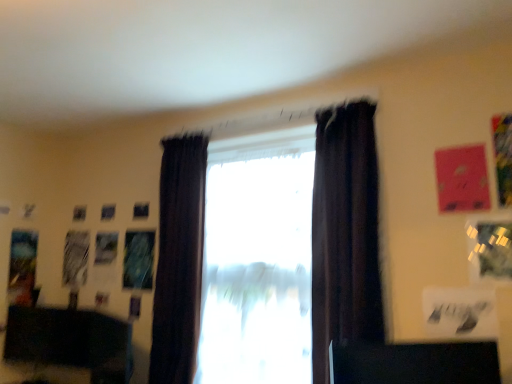
The height and width of the screenshot is (384, 512). Describe the element at coordinates (345, 233) in the screenshot. I see `dark velvet curtain at center, the second curtain from the back` at that location.

How much space does transparent glass window at center, which ranks as the 2th window in left-to-right order, occupy horizontally?

It is 15.23 centimeters.

In order to face black glossy desk at lower right, the 2th furniture ordered from the bottom, should I rotate leftwards or rightwards?

Rotate your view right by about 20.052°.

In order to face dark fabric curtain at center, acting as the first curtain starting from the back, should I rotate leftwards or rightwards?

You should look left and rotate roughly 10.536 degrees.

Measure the distance between dark fabric curtain at center, acting as the first curtain starting from the back, and camera.

7.79 feet.

Where is `satin dark curtains at center, the 2th window from the right`? The image size is (512, 384). satin dark curtains at center, the 2th window from the right is located at coordinates (344, 232).

This screenshot has height=384, width=512. What are the coordinates of `dark velvet curtain at center, the first curtain positioned from the front` in the screenshot? It's located at (345, 233).

Looking at this image, is satin dark curtains at center, marked as the 1th window in a left-to-right arrangement, further to camera compared to black glossy desk at lower right, arranged as the 2th furniture when viewed from the back?

Yes.

From the image's perspective, is satin dark curtains at center, marked as the 1th window in a left-to-right arrangement, on top of black glossy desk at lower right, which ranks as the 1th furniture in front-to-back order?

Yes, from the image's perspective, satin dark curtains at center, marked as the 1th window in a left-to-right arrangement, is above black glossy desk at lower right, which ranks as the 1th furniture in front-to-back order.

Would you say satin dark curtains at center, marked as the 1th window in a left-to-right arrangement, is a long distance from black glossy desk at lower right, which appears as the 2th furniture when viewed from the left?

Absolutely, satin dark curtains at center, marked as the 1th window in a left-to-right arrangement, is distant from black glossy desk at lower right, which appears as the 2th furniture when viewed from the left.

Is satin dark curtains at center, marked as the 1th window in a left-to-right arrangement, facing away from black glossy desk at lower right, arranged as the 2th furniture when viewed from the back?

satin dark curtains at center, marked as the 1th window in a left-to-right arrangement, is not turned away from black glossy desk at lower right, arranged as the 2th furniture when viewed from the back.

From the image's perspective, which is below, black glossy desk at lower right, which ranks as the 1th furniture in front-to-back order, or transparent glass window at center, which ranks as the 2th window in left-to-right order?

black glossy desk at lower right, which ranks as the 1th furniture in front-to-back order.

Relative to transparent glass window at center, which ranks as the 2th window in left-to-right order, is black glossy desk at lower right, acting as the first furniture starting from the top, in front or behind?

Visually, black glossy desk at lower right, acting as the first furniture starting from the top, is located in front of transparent glass window at center, which ranks as the 2th window in left-to-right order.

Who is bigger, black glossy desk at lower right, which appears as the 2th furniture when viewed from the left, or transparent glass window at center, acting as the first window starting from the right?

With larger size is transparent glass window at center, acting as the first window starting from the right.

Considering the sizes of black glossy desk at lower right, arranged as the 2th furniture when viewed from the back, and transparent glass window at center, acting as the first window starting from the right, in the image, is black glossy desk at lower right, arranged as the 2th furniture when viewed from the back, taller or shorter than transparent glass window at center, acting as the first window starting from the right,?

black glossy desk at lower right, arranged as the 2th furniture when viewed from the back, is shorter than transparent glass window at center, acting as the first window starting from the right.

In the image, is transparent glass window at center, which ranks as the 2th window in left-to-right order, positioned in front of or behind black matte desk at lower left, the second furniture when ordered from right to left?

In the image, transparent glass window at center, which ranks as the 2th window in left-to-right order, appears in front of black matte desk at lower left, the second furniture when ordered from right to left.

From a real-world perspective, which object rests below the other?

From a 3D spatial view, black matte desk at lower left, which is counted as the 1th furniture, starting from the left, is below.

Which is in front, point (222, 326) or point (112, 335)?

Positioned in front is point (222, 326).

In terms of height, does transparent glass window at center, which ranks as the 2th window in left-to-right order, look taller or shorter compared to black matte desk at lower left, the second furniture when ordered from right to left?

Considering their sizes, transparent glass window at center, which ranks as the 2th window in left-to-right order, has more height than black matte desk at lower left, the second furniture when ordered from right to left.

Looking at this image, could you tell me if dark velvet curtain at center, which is counted as the second curtain, starting from the left, is turned towards black matte desk at lower left, the second furniture when ordered from right to left?

No.

In the image, is dark velvet curtain at center, arranged as the 1th curtain when viewed from the right, on the left side or the right side of black matte desk at lower left, which ranks as the 2th furniture in front-to-back order?

Based on their positions, dark velvet curtain at center, arranged as the 1th curtain when viewed from the right, is located to the right of black matte desk at lower left, which ranks as the 2th furniture in front-to-back order.

Can you confirm if dark velvet curtain at center, arranged as the 1th curtain when viewed from the right, is wider than black matte desk at lower left, the second furniture when ordered from right to left?

Indeed, dark velvet curtain at center, arranged as the 1th curtain when viewed from the right, has a greater width compared to black matte desk at lower left, the second furniture when ordered from right to left.

From a real-world perspective, between dark velvet curtain at center, arranged as the 1th curtain when viewed from the right, and black matte desk at lower left, the second furniture when ordered from right to left, who is vertically higher?

dark velvet curtain at center, arranged as the 1th curtain when viewed from the right, from a real-world perspective.

Which object is more forward, satin dark curtains at center, marked as the 1th window in a left-to-right arrangement, or dark fabric curtain at center, acting as the first curtain starting from the back?

satin dark curtains at center, marked as the 1th window in a left-to-right arrangement, is in front.

Is satin dark curtains at center, marked as the 1th window in a left-to-right arrangement, not near dark fabric curtain at center, the 2th curtain from the right?

No, satin dark curtains at center, marked as the 1th window in a left-to-right arrangement, is not far away from dark fabric curtain at center, the 2th curtain from the right.

Between satin dark curtains at center, marked as the 1th window in a left-to-right arrangement, and dark fabric curtain at center, marked as the 2th curtain in a front-to-back arrangement, which one appears on the right side from the viewer's perspective?

Positioned to the right is satin dark curtains at center, marked as the 1th window in a left-to-right arrangement.

Who is bigger, satin dark curtains at center, the 2th window from the right, or dark fabric curtain at center, marked as the 2th curtain in a front-to-back arrangement?

With larger size is dark fabric curtain at center, marked as the 2th curtain in a front-to-back arrangement.

Is black matte desk at lower left, which ranks as the 2th furniture in front-to-back order, touching black glossy desk at lower right, which appears as the 2th furniture when viewed from the left?

No.

The image size is (512, 384). I want to click on furniture lying on the right of black matte desk at lower left, which ranks as the 2th furniture in front-to-back order, so click(x=414, y=363).

Is black matte desk at lower left, which ranks as the 2th furniture in front-to-back order, wider or thinner than black glossy desk at lower right, the 2th furniture ordered from the bottom?

In the image, black matte desk at lower left, which ranks as the 2th furniture in front-to-back order, appears to be more narrow than black glossy desk at lower right, the 2th furniture ordered from the bottom.

Which is in front, black matte desk at lower left, arranged as the second furniture when viewed from the top, or black glossy desk at lower right, which appears as the 2th furniture when viewed from the left?

black glossy desk at lower right, which appears as the 2th furniture when viewed from the left.

Which of these two, satin dark curtains at center, marked as the 1th window in a left-to-right arrangement, or transparent glass window at center, which ranks as the 2th window in left-to-right order, stands shorter?

transparent glass window at center, which ranks as the 2th window in left-to-right order.

From a real-world perspective, is satin dark curtains at center, the 2th window from the right, located beneath transparent glass window at center, acting as the first window starting from the right?

No.

At what (x,y) coordinates should I click in order to perform the action: click on window behind the satin dark curtains at center, marked as the 1th window in a left-to-right arrangement. Please return your answer as a coordinate pair (x, y). The height and width of the screenshot is (384, 512). Looking at the image, I should click on (258, 269).

How different are the orientations of satin dark curtains at center, marked as the 1th window in a left-to-right arrangement, and transparent glass window at center, acting as the first window starting from the right, in degrees?

0.00128 degrees.

Which window is the 1st one when counting from the back of the black glossy desk at lower right, the 2th furniture ordered from the bottom? Please provide its 2D coordinates.

[(344, 232)]

From the image's perspective, count 1st furnitures downward from the transparent glass window at center, which ranks as the 2th window in left-to-right order, and point to it. Please provide its 2D coordinates.

[(414, 363)]

Estimate the real-world distances between objects in this image. Which object is further from black matte desk at lower left, acting as the first furniture starting from the back, transparent glass window at center, which ranks as the 2th window in left-to-right order, or satin dark curtains at center, the 2th window from the right?

The object further to black matte desk at lower left, acting as the first furniture starting from the back, is transparent glass window at center, which ranks as the 2th window in left-to-right order.

From the image, which object appears to be nearer to dark fabric curtain at center, acting as the first curtain starting from the back, black matte desk at lower left, which ranks as the 2th furniture in front-to-back order, or transparent glass window at center, acting as the first window starting from the right?

Based on the image, transparent glass window at center, acting as the first window starting from the right, appears to be nearer to dark fabric curtain at center, acting as the first curtain starting from the back.

Considering their positions, is transparent glass window at center, which ranks as the 2th window in left-to-right order, positioned further to black glossy desk at lower right, arranged as the 2th furniture when viewed from the back, than satin dark curtains at center, the 2th window from the right?

satin dark curtains at center, the 2th window from the right.

Based on their spatial positions, is black glossy desk at lower right, arranged as the 2th furniture when viewed from the back, or dark velvet curtain at center, the second curtain from the back, closer to dark fabric curtain at center, the 2th curtain from the right?

Answer: Among the two, dark velvet curtain at center, the second curtain from the back, is located nearer to dark fabric curtain at center, the 2th curtain from the right.

From the image, which object appears to be farther from black matte desk at lower left, which ranks as the 2th furniture in front-to-back order, black glossy desk at lower right, which appears as the 2th furniture when viewed from the left, or satin dark curtains at center, marked as the 1th window in a left-to-right arrangement?

black glossy desk at lower right, which appears as the 2th furniture when viewed from the left, lies further to black matte desk at lower left, which ranks as the 2th furniture in front-to-back order, than the other object.

Looking at the image, which one is located further to transparent glass window at center, acting as the first window starting from the right, dark velvet curtain at center, which is counted as the second curtain, starting from the left, or satin dark curtains at center, marked as the 1th window in a left-to-right arrangement?

The object further to transparent glass window at center, acting as the first window starting from the right, is dark velvet curtain at center, which is counted as the second curtain, starting from the left.

Based on their spatial positions, is dark fabric curtain at center, acting as the first curtain starting from the back, or black glossy desk at lower right, arranged as the 2th furniture when viewed from the back, further from transparent glass window at center, which ranks as the 2th window in left-to-right order?

Among the two, black glossy desk at lower right, arranged as the 2th furniture when viewed from the back, is located further to transparent glass window at center, which ranks as the 2th window in left-to-right order.

From the image, which object appears to be nearer to black glossy desk at lower right, marked as the 1th furniture in a right-to-left arrangement, satin dark curtains at center, the 2th window from the right, or dark velvet curtain at center, the second curtain from the back?

Based on the image, dark velvet curtain at center, the second curtain from the back, appears to be nearer to black glossy desk at lower right, marked as the 1th furniture in a right-to-left arrangement.

I want to click on window located between satin dark curtains at center, marked as the 1th window in a left-to-right arrangement, and dark velvet curtain at center, the first curtain positioned from the front, in the left-right direction, so click(258, 269).

Where is `window between black matte desk at lower left, which is counted as the 1th furniture, starting from the left, and transparent glass window at center, acting as the first window starting from the right, from left to right`? window between black matte desk at lower left, which is counted as the 1th furniture, starting from the left, and transparent glass window at center, acting as the first window starting from the right, from left to right is located at coordinates (344, 232).

Where is `curtain between dark fabric curtain at center, the 1th curtain when ordered from left to right, and black glossy desk at lower right, acting as the first furniture starting from the top, in the horizontal direction`? This screenshot has width=512, height=384. curtain between dark fabric curtain at center, the 1th curtain when ordered from left to right, and black glossy desk at lower right, acting as the first furniture starting from the top, in the horizontal direction is located at coordinates (345, 233).

Locate an element on the screen. curtain located between black matte desk at lower left, which ranks as the 2th furniture in front-to-back order, and satin dark curtains at center, the 2th window from the right, in the left-right direction is located at coordinates (179, 260).